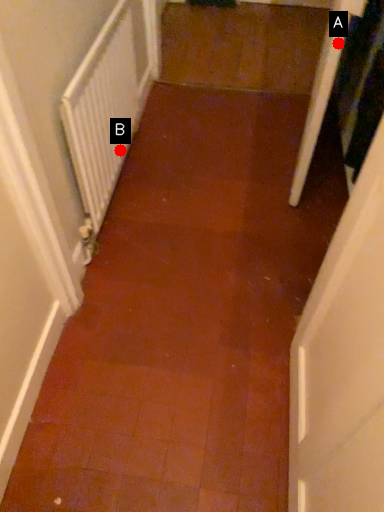
Question: Two points are circled on the image, labeled by A and B beside each circle. Which point appears closest to the camera in this image?

Choices:
 (A) A is closer
 (B) B is closer

Answer: (A)